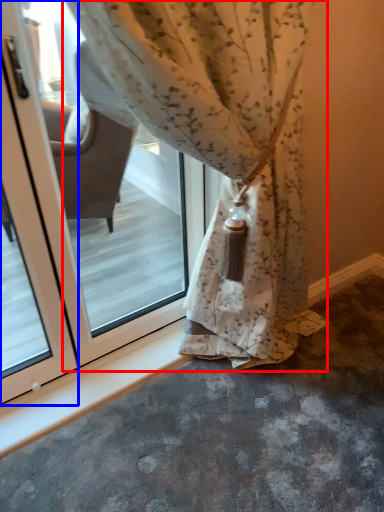
Question: Which point is further to the camera, curtain (highlighted by a red box) or screen door (highlighted by a blue box)?

Choices:
 (A) curtain
 (B) screen door

Answer: (B)